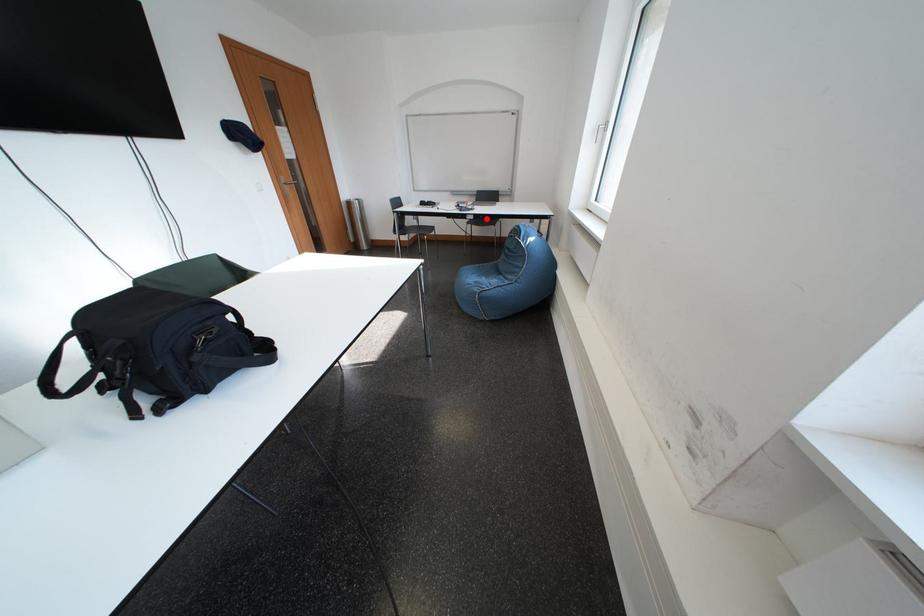
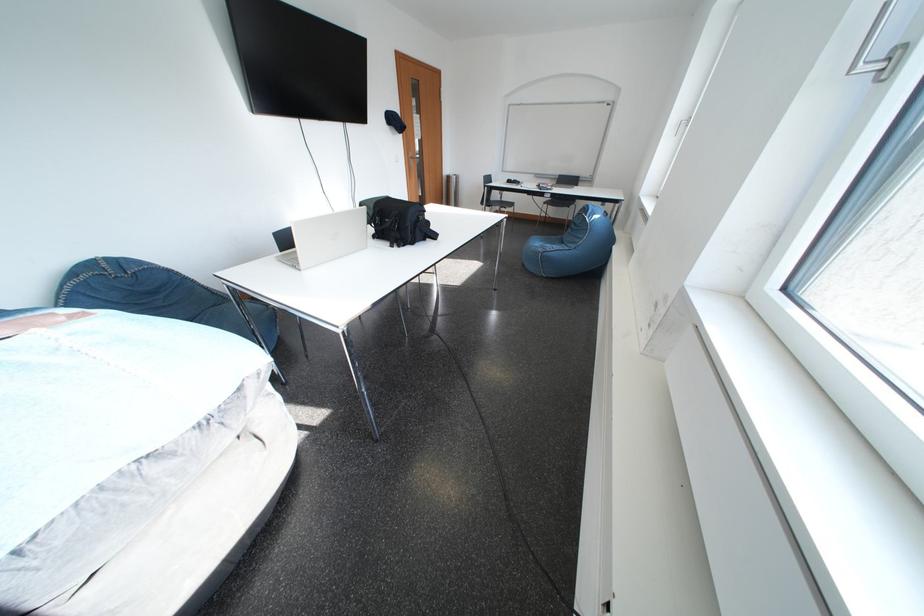
Question: I am providing you with two images of the same scene from different viewpoints. Given a red point in image1, look at the same physical point in image2. Is it:

Choices:
 (A) Closer to the viewpoint
 (B) Farther from the viewpoint

Answer: (B)